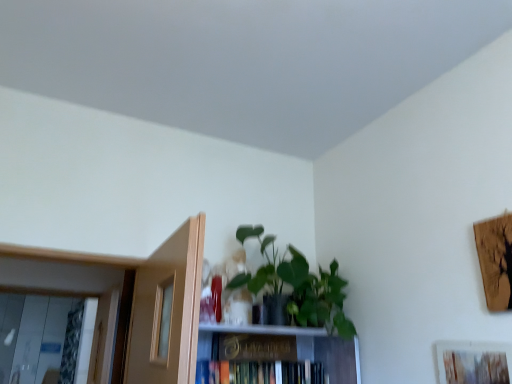
Find the location of a particular element. This screenshot has width=512, height=384. free space above hardcover book at center (from a real-world perspective) is located at coordinates (246, 353).